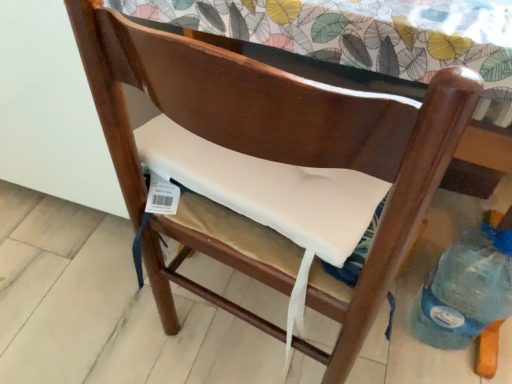
What are the coordinates of `free space in front of blue plastic bottle at lower right` in the screenshot? It's located at (453, 369).